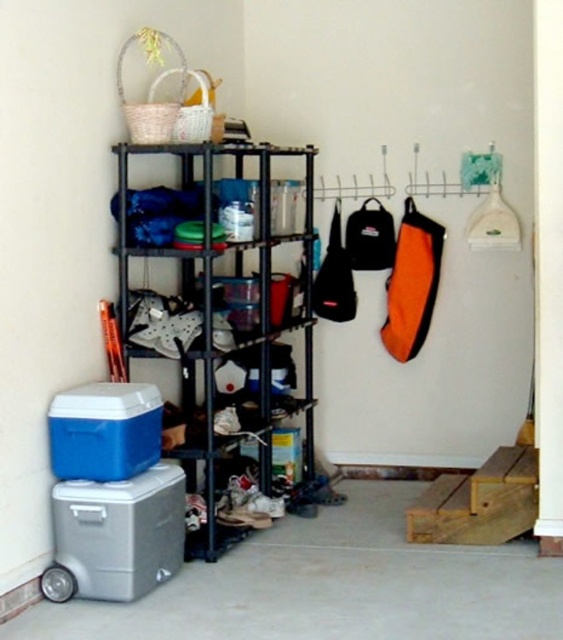
Question: Is gray plastic cooler at lower left positioned in front of blue plastic cooler at lower left?

Choices:
 (A) yes
 (B) no

Answer: (A)

Question: From the image, what is the correct spatial relationship of black metal shelf at center in relation to blue plastic cooler at lower left?

Choices:
 (A) left
 (B) right

Answer: (B)

Question: Based on their relative distances, which object is nearer to the gray plastic cooler at lower left?

Choices:
 (A) blue plastic cooler at lower left
 (B) black metal shelf at center

Answer: (A)

Question: Among these points, which one is nearest to the camera?

Choices:
 (A) (242, 243)
 (B) (109, 420)
 (C) (78, 515)

Answer: (B)

Question: Which of the following is the closest to the observer?

Choices:
 (A) gray plastic cooler at lower left
 (B) black metal shelf at center

Answer: (A)

Question: Can you confirm if black metal shelf at center is bigger than gray plastic cooler at lower left?

Choices:
 (A) yes
 (B) no

Answer: (A)